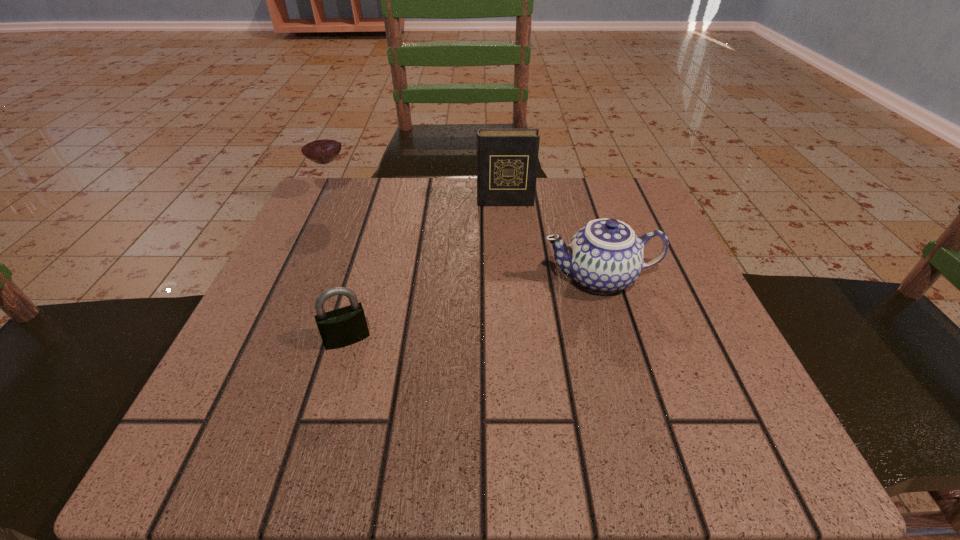
Where is `vacant area at the right edge`? The width and height of the screenshot is (960, 540). vacant area at the right edge is located at coordinates (671, 298).

This screenshot has width=960, height=540. I want to click on free region at the far left corner of the desktop, so click(366, 196).

Image resolution: width=960 pixels, height=540 pixels. Find the location of `vacant space at the near left corner`. vacant space at the near left corner is located at coordinates (269, 438).

The width and height of the screenshot is (960, 540). I want to click on vacant region at the far right corner of the desktop, so click(579, 197).

In the image, there is a desktop. Where is `free space at the near right corner`? free space at the near right corner is located at coordinates (666, 450).

I want to click on vacant space in between the wineglass and the diary, so click(420, 199).

The height and width of the screenshot is (540, 960). I want to click on empty location between the wineglass and the nearest object, so pos(340,268).

The image size is (960, 540). Find the location of `free space between the third object from right to left and the diary`. free space between the third object from right to left and the diary is located at coordinates (426, 271).

Where is `empty location between the nearest object and the wineglass`? This screenshot has height=540, width=960. empty location between the nearest object and the wineglass is located at coordinates (340, 268).

What are the coordinates of `free space between the diary and the leftmost object` in the screenshot? It's located at (420, 199).